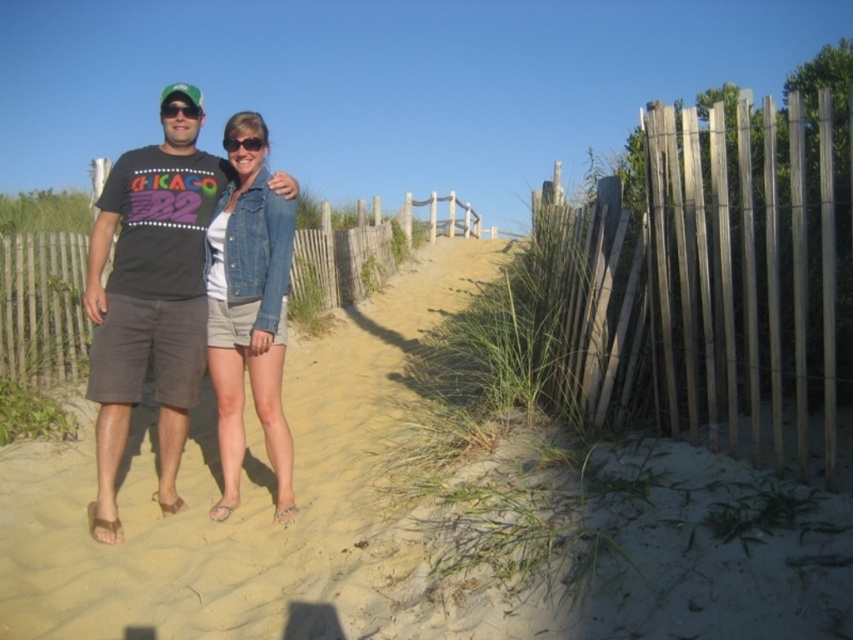
Question: Can you confirm if matte black t-shirt at center is positioned to the left of wooden fence at center?

Choices:
 (A) yes
 (B) no

Answer: (A)

Question: Is weathered wood fence at right wider than matte black t-shirt at center?

Choices:
 (A) no
 (B) yes

Answer: (B)

Question: Which of the following is the farthest from the observer?

Choices:
 (A) (112, 212)
 (B) (93, 576)
 (C) (339, 241)

Answer: (C)

Question: Does matte black t-shirt at center have a lesser width compared to black matte sunglasses at center?

Choices:
 (A) yes
 (B) no

Answer: (B)

Question: Which object is closer to the camera taking this photo?

Choices:
 (A) beige sandy path at center
 (B) weathered wood fence at right
 (C) denim jacket at center
 (D) wooden fence at center

Answer: (A)

Question: Among these objects, which one is farthest from the camera?

Choices:
 (A) matte black t-shirt at center
 (B) wooden fence at center
 (C) beige sandy path at center

Answer: (B)